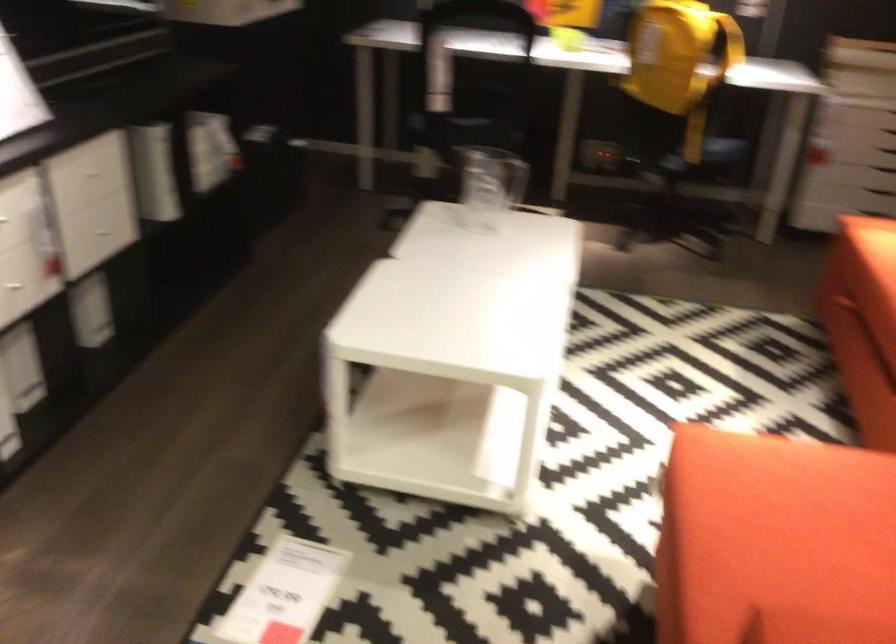
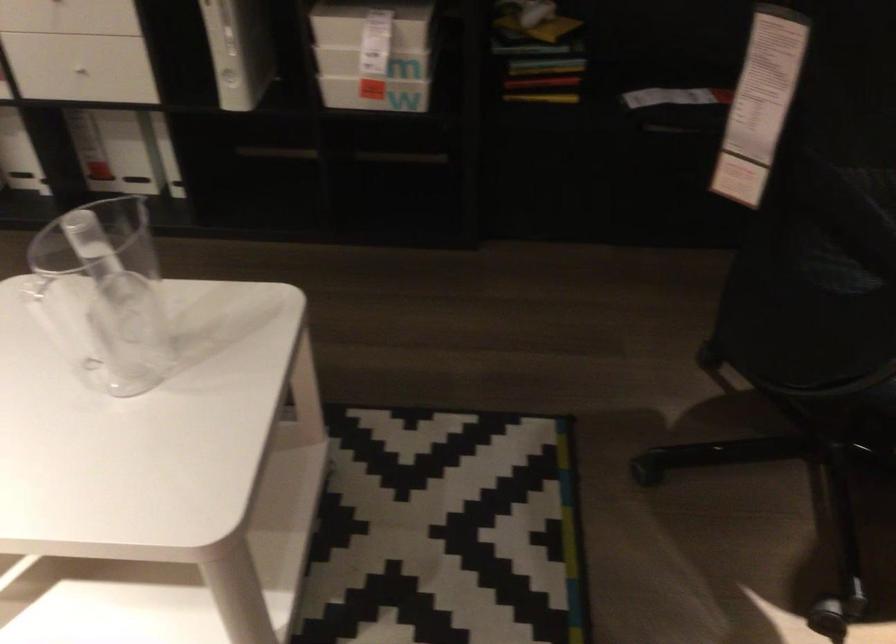
Locate, in the second image, the point that corresponds to [192,137] in the first image.

(371, 24)